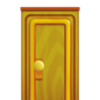
This screenshot has height=100, width=100. I want to click on top of door frame, so click(x=44, y=8).